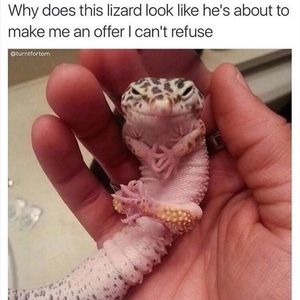
Identify the location of left front leg. (169, 156).